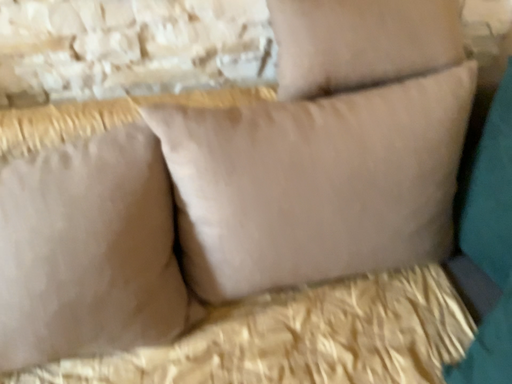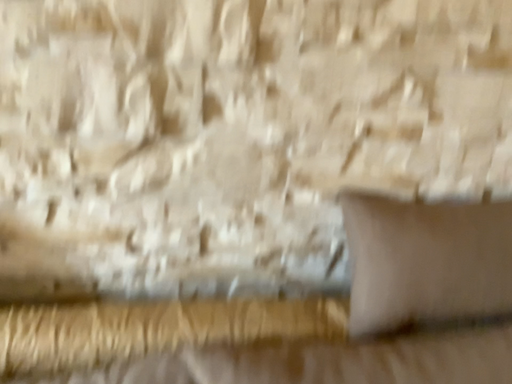
Question: How did the camera likely rotate when shooting the video?

Choices:
 (A) rotated left
 (B) rotated right

Answer: (A)